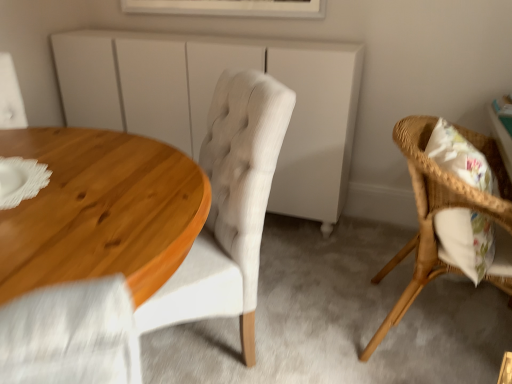
Image resolution: width=512 pixels, height=384 pixels. What do you see at coordinates (100, 211) in the screenshot?
I see `wooden table at left` at bounding box center [100, 211].

Describe the element at coordinates (211, 100) in the screenshot. I see `white matte cabinet at center` at that location.

Image resolution: width=512 pixels, height=384 pixels. Find the location of `light beige fabric chair at center, the 2th chair positioned from the right`. light beige fabric chair at center, the 2th chair positioned from the right is located at coordinates (229, 208).

Find the location of `woven wood chair at right, which is the 1th chair in right-to-left order`. woven wood chair at right, which is the 1th chair in right-to-left order is located at coordinates (440, 209).

This screenshot has height=384, width=512. Find the location of `wooden table at left`. wooden table at left is located at coordinates (100, 211).

Consider the image. Which is closer to the camera, (229, 176) or (121, 128)?

Positioned in front is point (229, 176).

Is light beige fabric chair at center, which is the first chair in left-to-right order, at the right side of white matte cabinet at center?

Yes.

How different are the orientations of light beige fabric chair at center, the 2th chair positioned from the right, and white matte cabinet at center in degrees?

The facing directions of light beige fabric chair at center, the 2th chair positioned from the right, and white matte cabinet at center are 35.7 degrees apart.

How much distance is there between light beige fabric chair at center, the 2th chair positioned from the right, and white matte cabinet at center?

The distance of light beige fabric chair at center, the 2th chair positioned from the right, from white matte cabinet at center is 33.72 inches.

Looking at this image, can you confirm if woven wood chair at right, which is the 1th chair in right-to-left order, is bigger than wooden table at left?

Correct, woven wood chair at right, which is the 1th chair in right-to-left order, is larger in size than wooden table at left.

Is woven wood chair at right, marked as the 2th chair in a left-to-right arrangement, positioned beyond the bounds of wooden table at left?

woven wood chair at right, marked as the 2th chair in a left-to-right arrangement, is positioned outside wooden table at left.

At what (x,y) coordinates should I click in order to perform the action: click on coffee table on the left of woven wood chair at right, marked as the 2th chair in a left-to-right arrangement. Please return your answer as a coordinate pair (x, y). This screenshot has height=384, width=512. Looking at the image, I should click on (100, 211).

Which is in front, white framed picture at upper center or woven wood chair at right, which is the 1th chair in right-to-left order?

woven wood chair at right, which is the 1th chair in right-to-left order, is closer to the camera.

Which is nearer, (229, 11) or (425, 213)?

Positioned in front is point (425, 213).

Would you consider white framed picture at upper center to be distant from woven wood chair at right, marked as the 2th chair in a left-to-right arrangement?

Yes, white framed picture at upper center is far from woven wood chair at right, marked as the 2th chair in a left-to-right arrangement.

How far apart are white matte cabinet at center and white framed picture at upper center?

white matte cabinet at center is 18.35 inches from white framed picture at upper center.

Consider the image. Is white matte cabinet at center facing away from white framed picture at upper center?

That's not correct — white matte cabinet at center is not looking away from white framed picture at upper center.

Is white matte cabinet at center positioned before white framed picture at upper center?

That is True.

Is white matte cabinet at center not inside white framed picture at upper center?

Yes, white matte cabinet at center is outside of white framed picture at upper center.

How distant is light beige fabric chair at center, which is the first chair in left-to-right order, from woven wood chair at right, marked as the 2th chair in a left-to-right arrangement?

They are 22.28 inches apart.

Can you confirm if light beige fabric chair at center, the 2th chair positioned from the right, is shorter than woven wood chair at right, marked as the 2th chair in a left-to-right arrangement?

In fact, light beige fabric chair at center, the 2th chair positioned from the right, may be taller than woven wood chair at right, marked as the 2th chair in a left-to-right arrangement.

Is light beige fabric chair at center, the 2th chair positioned from the right, positioned with its back to woven wood chair at right, marked as the 2th chair in a left-to-right arrangement?

light beige fabric chair at center, the 2th chair positioned from the right, is not turned away from woven wood chair at right, marked as the 2th chair in a left-to-right arrangement.

Between light beige fabric chair at center, the 2th chair positioned from the right, and woven wood chair at right, marked as the 2th chair in a left-to-right arrangement, which one appears on the right side from the viewer's perspective?

From the viewer's perspective, woven wood chair at right, marked as the 2th chair in a left-to-right arrangement, appears more on the right side.

Is light beige fabric chair at center, which is the first chair in left-to-right order, situated inside wooden table at left or outside?

The correct answer is: outside.

Considering their positions, is light beige fabric chair at center, which is the first chair in left-to-right order, located in front of or behind wooden table at left?

light beige fabric chair at center, which is the first chair in left-to-right order, is behind wooden table at left.

Considering the relative sizes of light beige fabric chair at center, which is the first chair in left-to-right order, and wooden table at left in the image provided, is light beige fabric chair at center, which is the first chair in left-to-right order, wider than wooden table at left?

No.

Does white framed picture at upper center have a smaller size compared to light beige fabric chair at center, which is the first chair in left-to-right order?

Yes, white framed picture at upper center is smaller than light beige fabric chair at center, which is the first chair in left-to-right order.

Considering the positions of objects white framed picture at upper center and light beige fabric chair at center, which is the first chair in left-to-right order, in the image provided, who is more to the left, white framed picture at upper center or light beige fabric chair at center, which is the first chair in left-to-right order,?

Positioned to the left is white framed picture at upper center.

Would you say white framed picture at upper center is inside or outside light beige fabric chair at center, the 2th chair positioned from the right?

white framed picture at upper center is not enclosed by light beige fabric chair at center, the 2th chair positioned from the right.

Find the location of a particular element. Image resolution: width=512 pixels, height=384 pixels. window behind the light beige fabric chair at center, the 2th chair positioned from the right is located at coordinates (230, 8).

Which chair is the 1st one when counting from the right side of the white matte cabinet at center? Please provide its 2D coordinates.

[(229, 208)]

There is a wooden table at left. What are the coordinates of `the 1st chair above it (from the image's perspective)` in the screenshot? It's located at (440, 209).

Estimate the real-world distances between objects in this image. Which object is closer to white framed picture at upper center, light beige fabric chair at center, the 2th chair positioned from the right, or wooden table at left?

Among the two, light beige fabric chair at center, the 2th chair positioned from the right, is located nearer to white framed picture at upper center.

Considering their positions, is white matte cabinet at center positioned closer to woven wood chair at right, marked as the 2th chair in a left-to-right arrangement, than light beige fabric chair at center, the 2th chair positioned from the right?

light beige fabric chair at center, the 2th chair positioned from the right, lies closer to woven wood chair at right, marked as the 2th chair in a left-to-right arrangement, than the other object.

Looking at the image, which one is located closer to light beige fabric chair at center, which is the first chair in left-to-right order, woven wood chair at right, marked as the 2th chair in a left-to-right arrangement, or white framed picture at upper center?

The object closer to light beige fabric chair at center, which is the first chair in left-to-right order, is woven wood chair at right, marked as the 2th chair in a left-to-right arrangement.

From the image, which object appears to be nearer to wooden table at left, woven wood chair at right, marked as the 2th chair in a left-to-right arrangement, or light beige fabric chair at center, the 2th chair positioned from the right?

light beige fabric chair at center, the 2th chair positioned from the right, lies closer to wooden table at left than the other object.

Which object lies nearer to the anchor point woven wood chair at right, marked as the 2th chair in a left-to-right arrangement, light beige fabric chair at center, which is the first chair in left-to-right order, or wooden table at left?

Among the two, light beige fabric chair at center, which is the first chair in left-to-right order, is located nearer to woven wood chair at right, marked as the 2th chair in a left-to-right arrangement.

Which object lies nearer to the anchor point wooden table at left, white framed picture at upper center or woven wood chair at right, which is the 1th chair in right-to-left order?

woven wood chair at right, which is the 1th chair in right-to-left order, is positioned closer to the anchor wooden table at left.

Considering their positions, is woven wood chair at right, marked as the 2th chair in a left-to-right arrangement, positioned further to white framed picture at upper center than wooden table at left?

Among the two, wooden table at left is located further to white framed picture at upper center.

When comparing their distances from white matte cabinet at center, does wooden table at left or woven wood chair at right, marked as the 2th chair in a left-to-right arrangement, seem closer?

woven wood chair at right, marked as the 2th chair in a left-to-right arrangement, is positioned closer to the anchor white matte cabinet at center.

Locate an element on the screen. The image size is (512, 384). chair situated between white matte cabinet at center and woven wood chair at right, marked as the 2th chair in a left-to-right arrangement, from left to right is located at coordinates (229, 208).

This screenshot has width=512, height=384. Identify the location of cabinetry between light beige fabric chair at center, which is the first chair in left-to-right order, and white framed picture at upper center in the front-back direction. (211, 100).

Image resolution: width=512 pixels, height=384 pixels. I want to click on cabinetry between white framed picture at upper center and woven wood chair at right, marked as the 2th chair in a left-to-right arrangement, in the up-down direction, so click(x=211, y=100).

Identify the location of cabinetry between wooden table at left and white framed picture at upper center in the front-back direction. (211, 100).